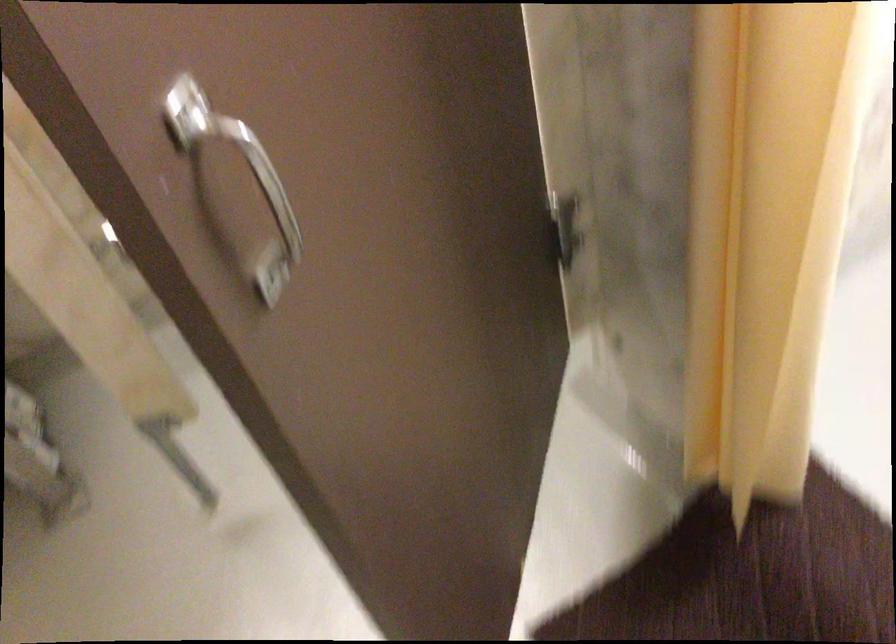
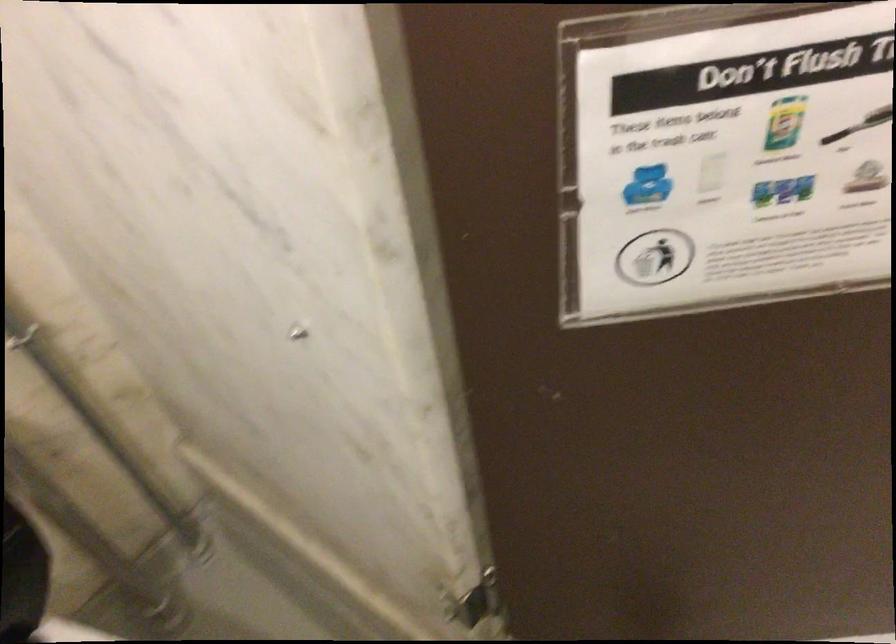
Find the pixel in the second image that matches point 545,213 in the first image.

(476, 603)